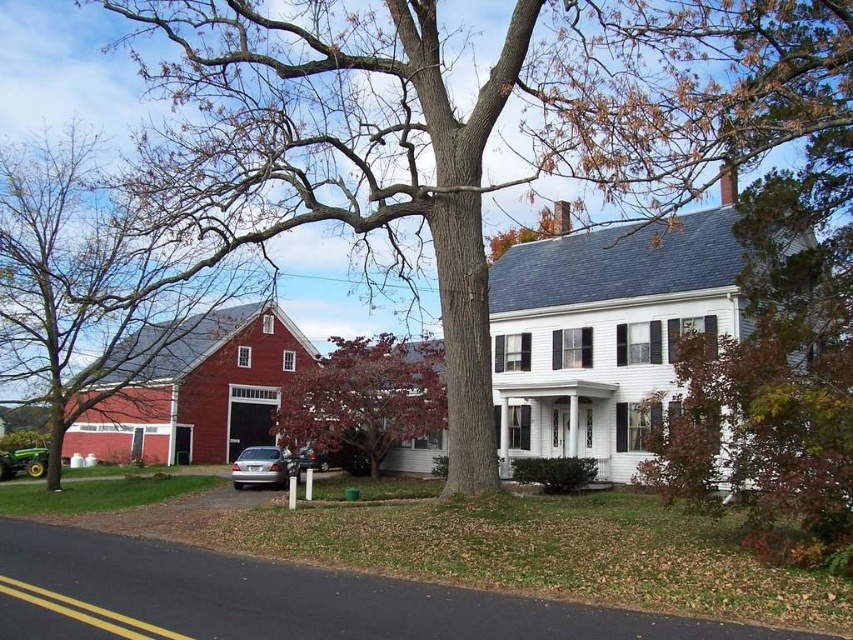
Question: Which of the following is the farthest from the observer?

Choices:
 (A) white wood house at upper right
 (B) smooth red barn at left

Answer: (B)

Question: Which of these objects is positioned farthest from the smooth red barn at left?

Choices:
 (A) metallic silver sedan at center
 (B) reddish-brown bark tree at center
 (C) white wood house at upper right
 (D) bare wood tree at center

Answer: (C)

Question: Can you confirm if reddish-brown bark tree at center is positioned to the right of satin silver sedan at center?

Choices:
 (A) no
 (B) yes

Answer: (B)

Question: In this image, where is bare wood tree at center located relative to white wood house at upper right?

Choices:
 (A) right
 (B) left

Answer: (B)

Question: Can you confirm if white wood house at upper right is bigger than satin silver sedan at center?

Choices:
 (A) no
 (B) yes

Answer: (B)

Question: Which of the following is the farthest from the observer?

Choices:
 (A) metallic silver sedan at center
 (B) bare wood tree at center
 (C) smooth red barn at left

Answer: (A)